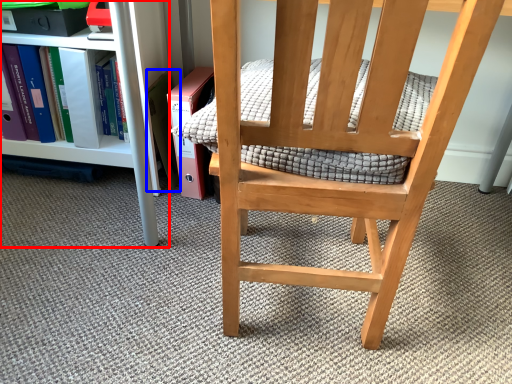
Question: Which object appears closest to the camera in this image, shelf (highlighted by a red box) or paperback book (highlighted by a blue box)?

Choices:
 (A) shelf
 (B) paperback book

Answer: (A)